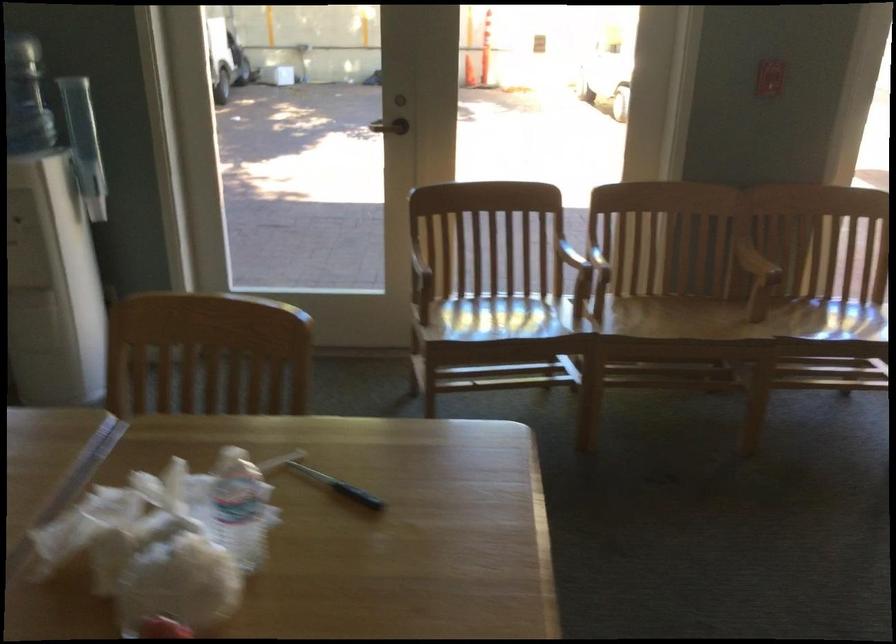
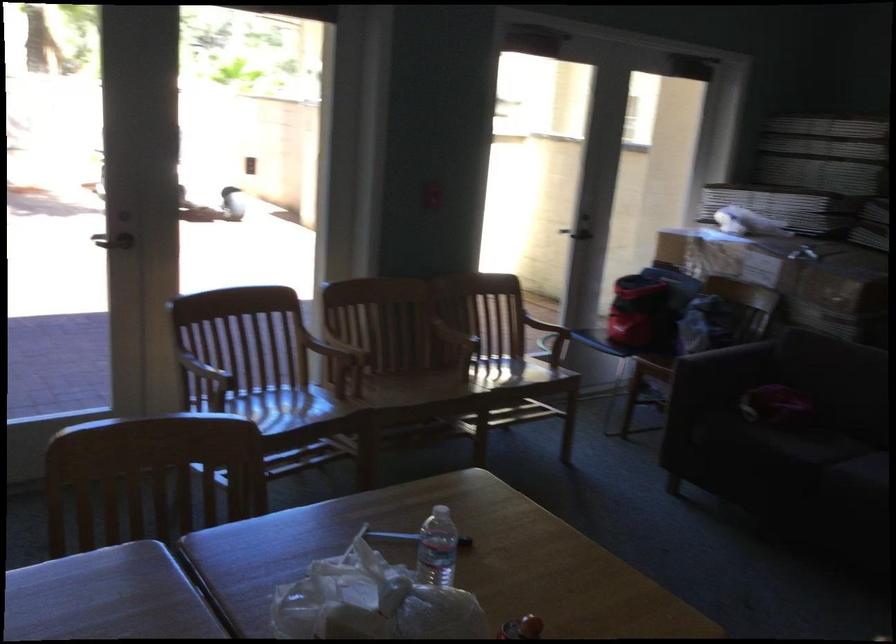
The point at (234, 512) is marked in the first image. Where is the corresponding point in the second image?

(437, 547)